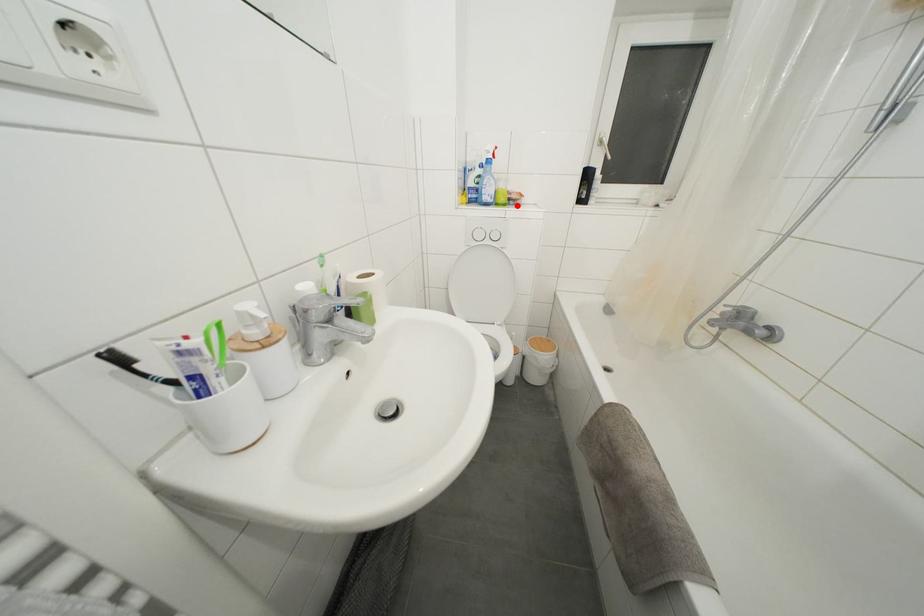
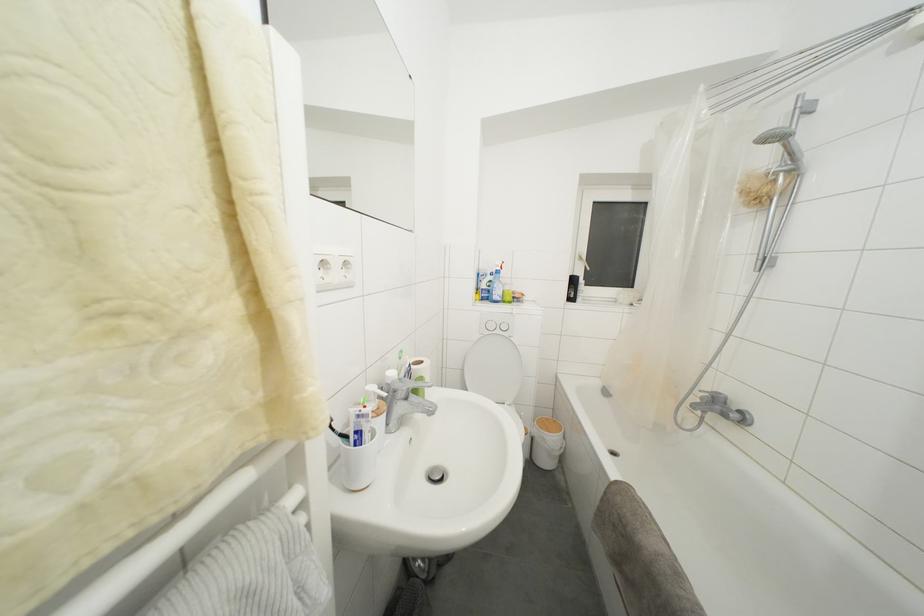
Locate, in the second image, the point that corresponds to the highlighted location in the first image.

(520, 304)